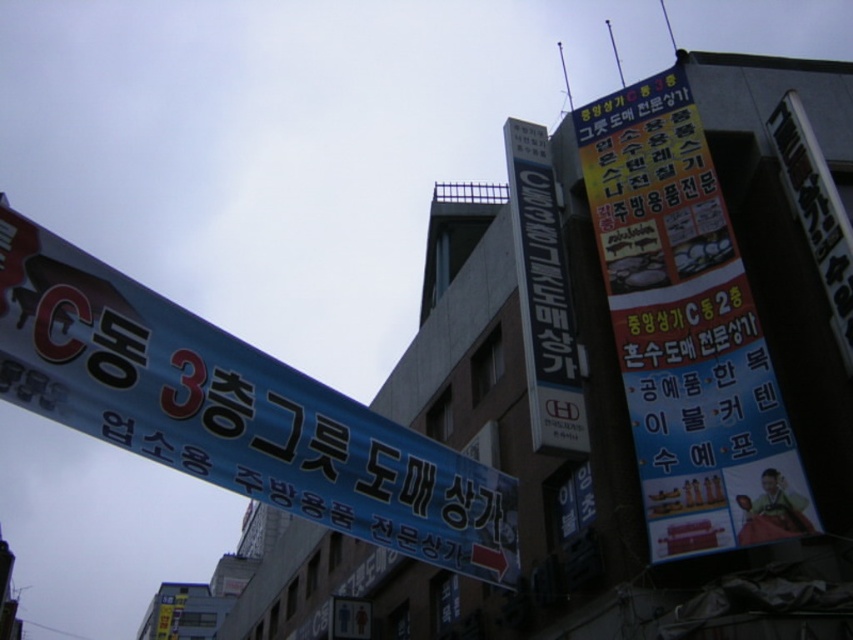
You are a pedestrian in the city and want to read both the yellow paper sign at upper right and the blue metallic sign at center. Which one do you need to look up higher to see?

The yellow paper sign at upper right is much taller than the blue metallic sign at center, so you need to look up higher to see the yellow paper sign at upper right.

You are standing in the urban scene depicted in the image. You want to locate the yellow paper sign at upper right. According to the coordinates provided, where should you look relative to the large blue banner?

The yellow paper sign at upper right is located at coordinates point (686, 330), which is to the upper right of the large blue banner.